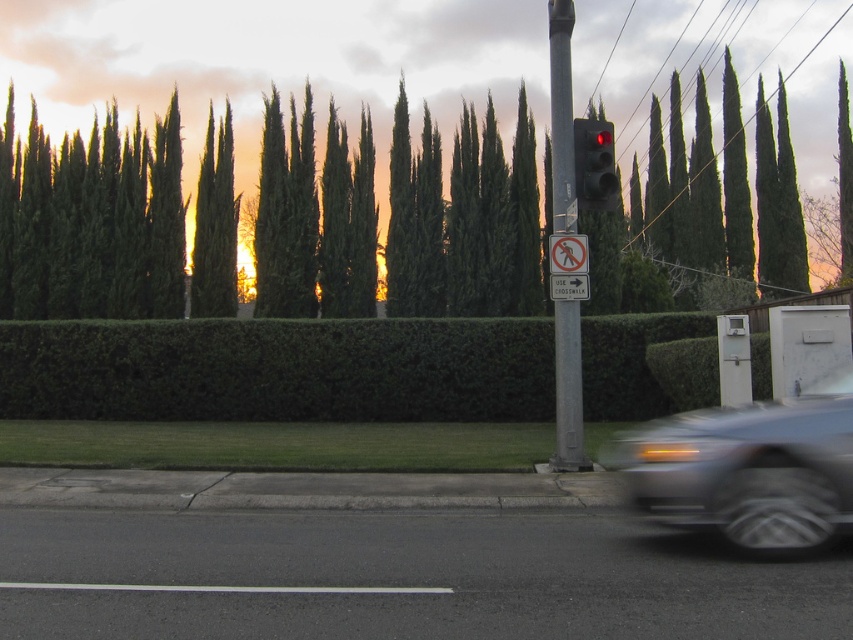
Question: Which of these objects is positioned farthest from the white plastic sign at center?

Choices:
 (A) green leafy hedge at center
 (B) green leafy trees at upper center

Answer: (B)

Question: Among these objects, which one is farthest from the camera?

Choices:
 (A) green leafy hedge at center
 (B) white plastic sign at center
 (C) matte black traffic light at upper right
 (D) silver metallic pole at center

Answer: (A)

Question: Which point is farther to the camera?

Choices:
 (A) metallic gray car at lower right
 (B) matte black traffic light at upper right

Answer: (B)

Question: Is green leafy trees at upper center to the left of metallic wire at upper center from the viewer's perspective?

Choices:
 (A) no
 (B) yes

Answer: (B)

Question: Is green leafy trees at upper center wider than white plastic sign at center?

Choices:
 (A) yes
 (B) no

Answer: (A)

Question: Does white plastic pedestrian crossing sign at center lie behind white plastic sign at center?

Choices:
 (A) yes
 (B) no

Answer: (A)